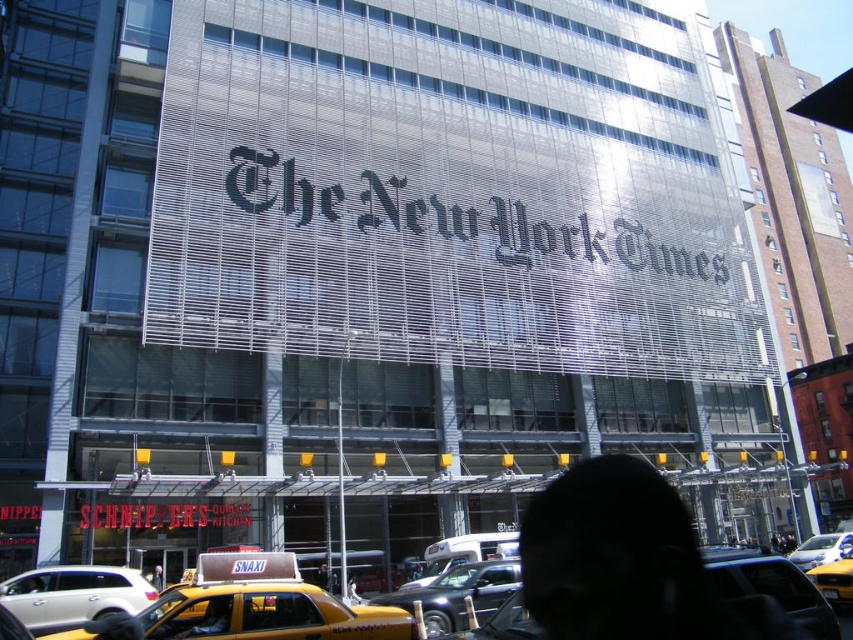
You are a pedestrian standing on the sidewalk in front of The New York Times building. You see a metallic silver car at center and a yellow taxi cab at center. Which vehicle is closer to the building?

The metallic silver car at center is positioned on the left side of the yellow taxi cab at center, so it is closer to the building.

You are a pedestrian standing on the sidewalk in front of The New York Times building. You see two yellow taxis. One is the yellow matte taxi at lower center and the other is the yellow taxi cab at center. Which taxi is closer to the left side of the street?

The yellow matte taxi at lower center is positioned on the left side of yellow taxi cab at center, so it is closer to the left side of the street.

You are a delivery person needing to park your 1.8 meters wide van. You see the white glossy sedan at lower left and the yellow rubber taxi at center. Which vehicle can your van fit next to without overlapping?

The white glossy sedan at lower left has a larger width than the yellow rubber taxi at center, so your van can fit next to the white glossy sedan at lower left.